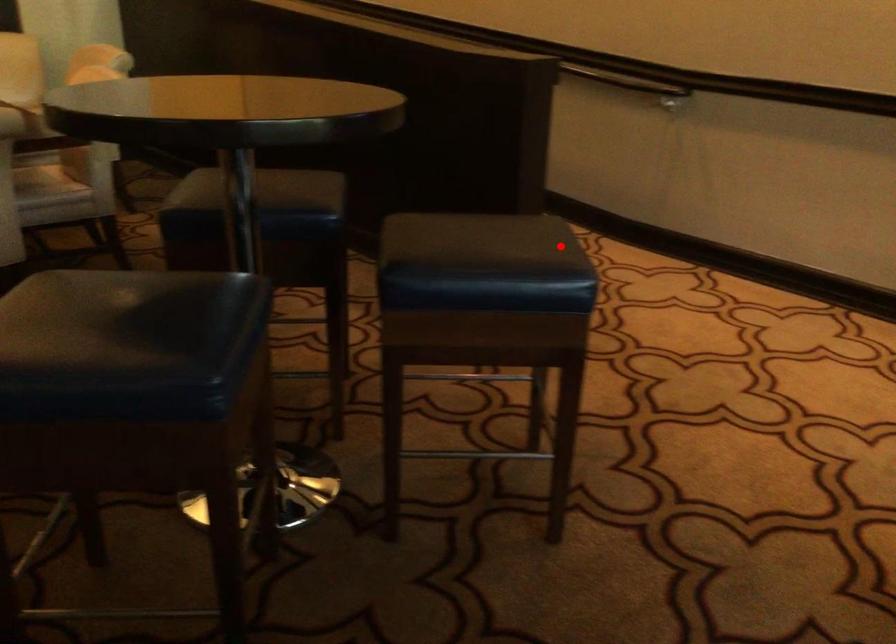
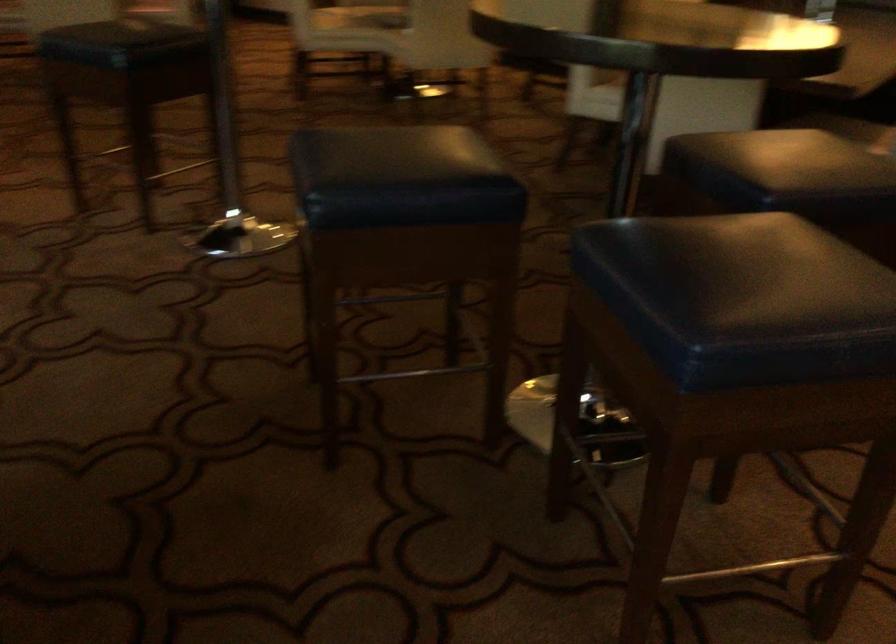
In the second image, find the point that corresponds to the highlighted location in the first image.

(742, 299)